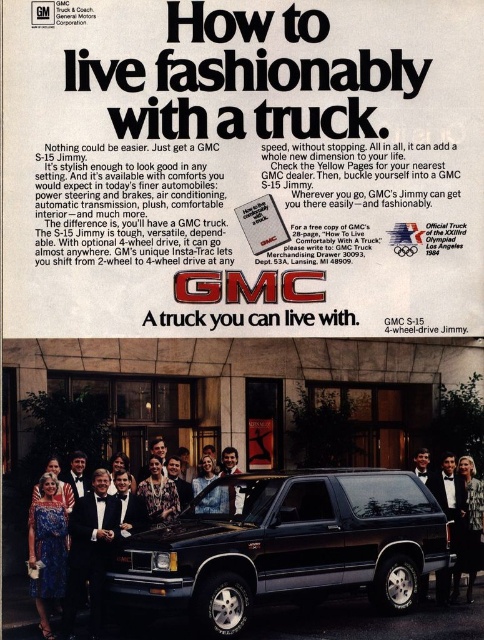
Question: Which point appears closest to the camera in this image?

Choices:
 (A) (49, 508)
 (B) (95, 580)
 (C) (155, 483)
 (D) (218, 499)

Answer: (B)

Question: Can you confirm if matte black suv at center is positioned below shiny black suv at center?

Choices:
 (A) no
 (B) yes

Answer: (A)

Question: Which object appears farthest from the camera in this image?

Choices:
 (A) shiny black suv at center
 (B) matte black suv at center

Answer: (B)

Question: Estimate the real-world distances between objects in this image. Which object is farther from the black tuxedo at center?

Choices:
 (A) silky black dress at lower right
 (B) matte black suv at center
 (C) matte black dress at lower left
 (D) floral dress at center

Answer: (B)

Question: Can you confirm if shiny black suv at center is bigger than smooth leather jacket at center?

Choices:
 (A) yes
 (B) no

Answer: (A)

Question: Is matte black dress at lower left above floral dress at center?

Choices:
 (A) yes
 (B) no

Answer: (B)